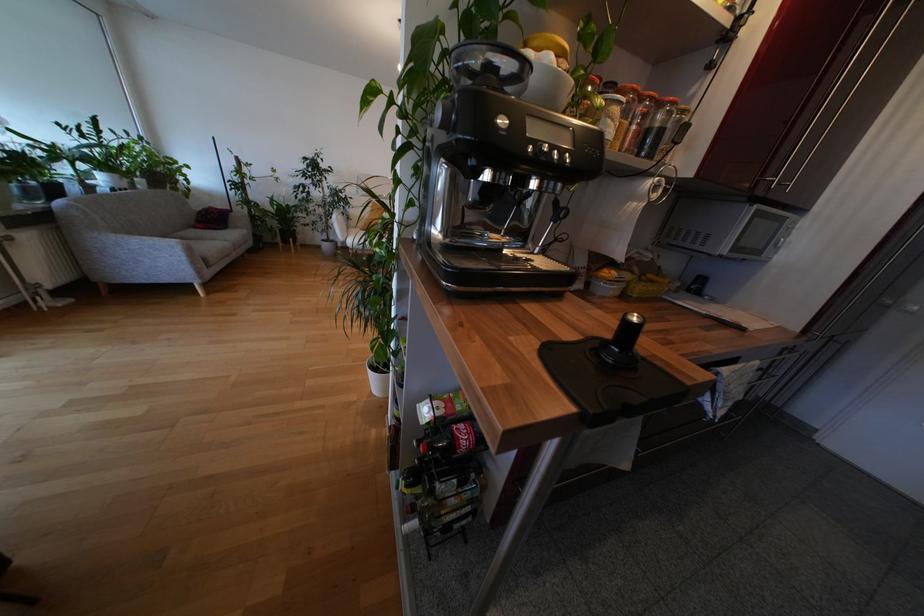
Where would you pivot the metal steam wand? Please return your answer as a coordinate pair (x, y).

(552, 221)